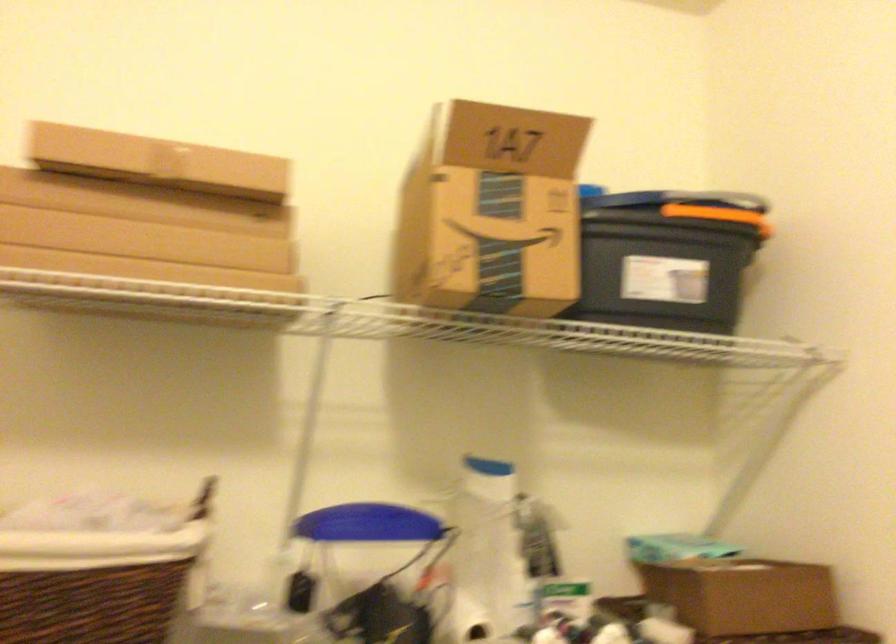
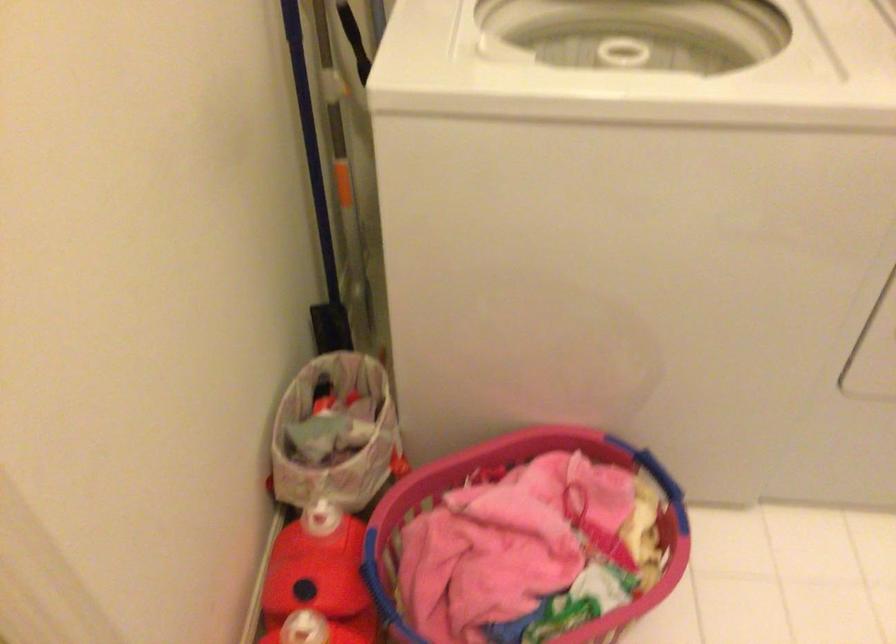
The first image is from the beginning of the video and the second image is from the end. How did the camera likely rotate when shooting the video?

The camera rotated toward left-down.